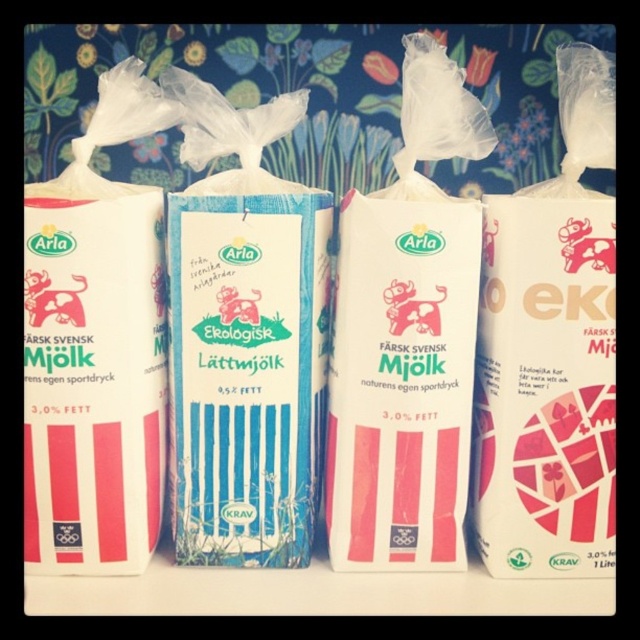
Question: Is blue striped carton at center to the left of matte white milk carton at left from the viewer's perspective?

Choices:
 (A) yes
 (B) no

Answer: (B)

Question: Is matte white milk carton at center further to the viewer compared to pink paper carton at right?

Choices:
 (A) yes
 (B) no

Answer: (A)

Question: Which point is closer to the camera taking this photo?

Choices:
 (A) (554, 404)
 (B) (56, 396)

Answer: (B)

Question: Where is blue striped carton at center located in relation to pink paper carton at right in the image?

Choices:
 (A) above
 (B) below

Answer: (B)

Question: Which object is the farthest from the matte white milk carton at center?

Choices:
 (A) pink paper carton at right
 (B) blue striped carton at center

Answer: (B)

Question: Which point is farther to the camera?

Choices:
 (A) matte white milk carton at center
 (B) matte white milk carton at left
 (C) blue striped carton at center

Answer: (C)